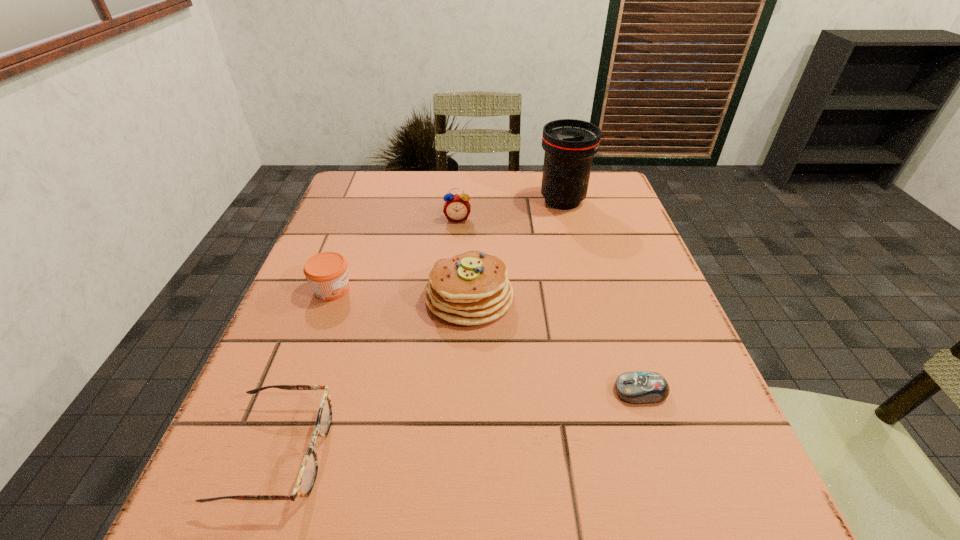
The width and height of the screenshot is (960, 540). In order to click on computer mouse located in the right edge section of the desktop in this screenshot , I will do 643,387.

Where is `object at the near left corner`? This screenshot has height=540, width=960. object at the near left corner is located at coordinates point(308,472).

Find the location of a particular element. The image size is (960, 540). object at the far right corner is located at coordinates (569, 144).

The width and height of the screenshot is (960, 540). I want to click on free space at the far edge of the desktop, so click(x=490, y=181).

The image size is (960, 540). I want to click on vacant position at the left edge of the desktop, so click(x=343, y=336).

This screenshot has width=960, height=540. I want to click on vacant space at the right edge, so click(x=615, y=379).

This screenshot has width=960, height=540. I want to click on free space at the far right corner of the desktop, so click(x=573, y=213).

At what (x,y) coordinates should I click in order to perform the action: click on vacant area at the near right corner. Please return your answer as a coordinate pair (x, y). The image size is (960, 540). Looking at the image, I should click on (758, 514).

You are a GUI agent. You are given a task and a screenshot of the screen. Output one action in this format:
    pyautogui.click(x=<x>, y=<y>)
    Task: Click on the vacant region between the pancake and the spectacles
    
    Given the screenshot: What is the action you would take?
    pyautogui.click(x=373, y=375)

Where is `vacant area that lies between the second shortest object and the pancake`? vacant area that lies between the second shortest object and the pancake is located at coordinates (373, 375).